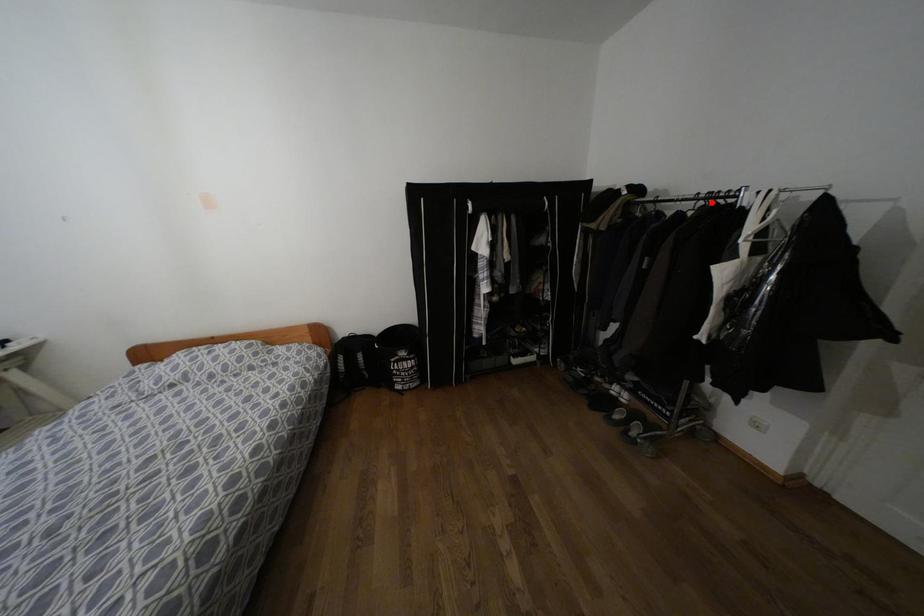
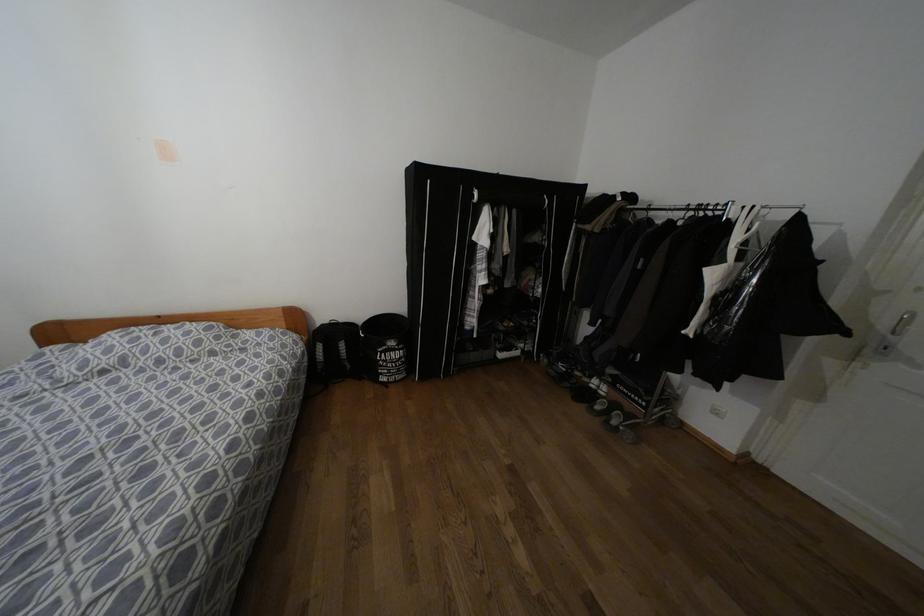
In the second image, find the point that corresponds to the highlighted location in the first image.

(700, 214)